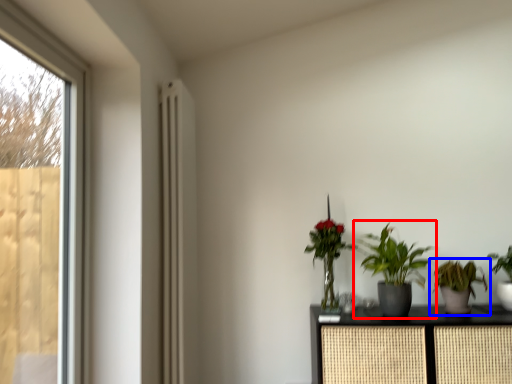
Question: Which point is further to the camera, houseplant (highlighted by a red box) or houseplant (highlighted by a blue box)?

Choices:
 (A) houseplant
 (B) houseplant

Answer: (B)